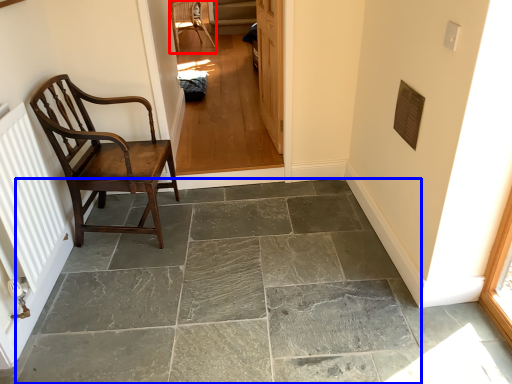
Question: Which point is further to the camera, chair (highlighted by a red box) or concrete (highlighted by a blue box)?

Choices:
 (A) chair
 (B) concrete

Answer: (A)